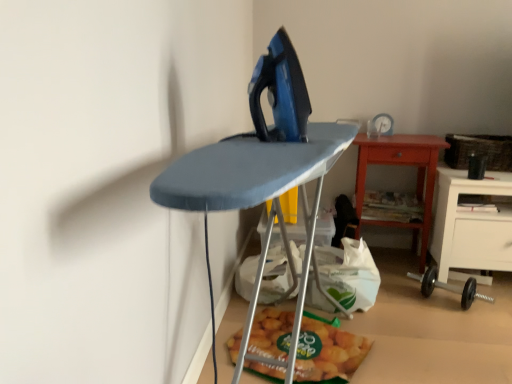
Locate an element on the screen. free space to the right of white plastic grocery bag at lower center is located at coordinates (406, 300).